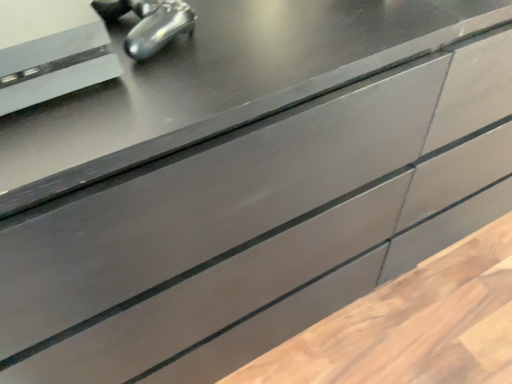
At what (x,y) coordinates should I click in order to perform the action: click on vacant space in front of metallic silver tap at upper left. Please return your answer as a coordinate pair (x, y). The height and width of the screenshot is (384, 512). Looking at the image, I should click on (136, 102).